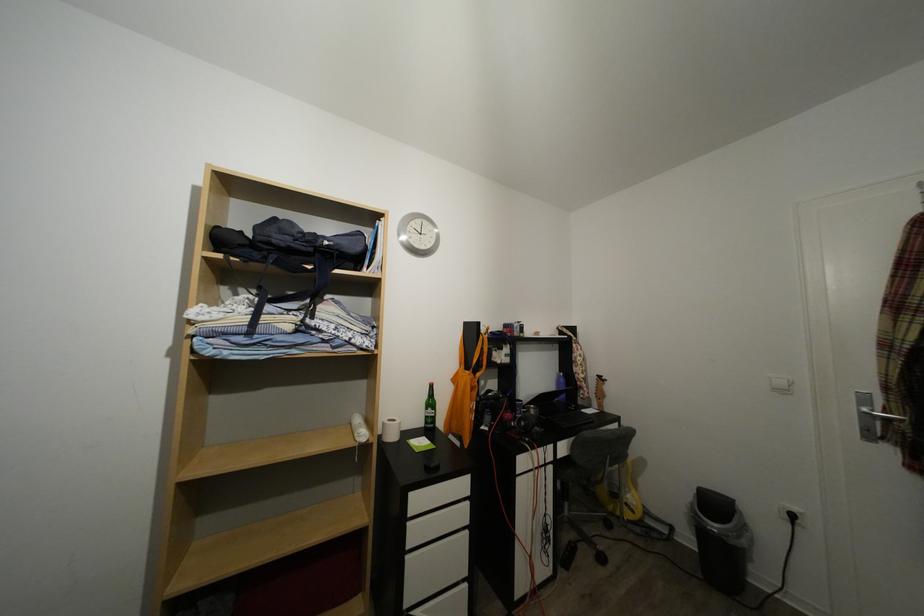
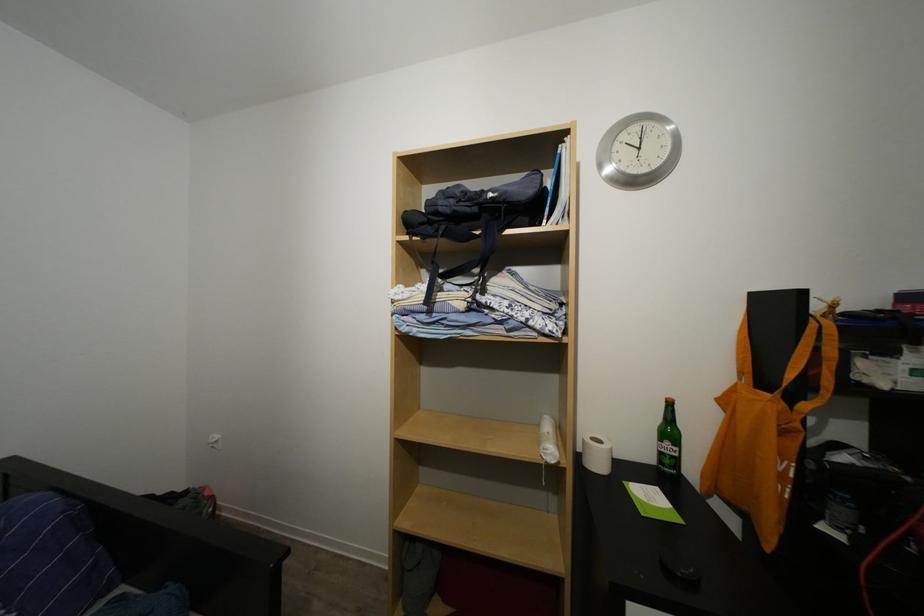
Locate, in the second image, the point that corresponds to point (438, 416) in the first image.

(675, 450)